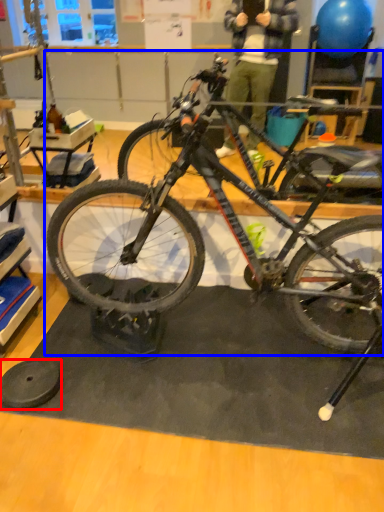
Question: Which point is further to the camera, wheel (highlighted by a red box) or bicycle (highlighted by a blue box)?

Choices:
 (A) wheel
 (B) bicycle

Answer: (A)